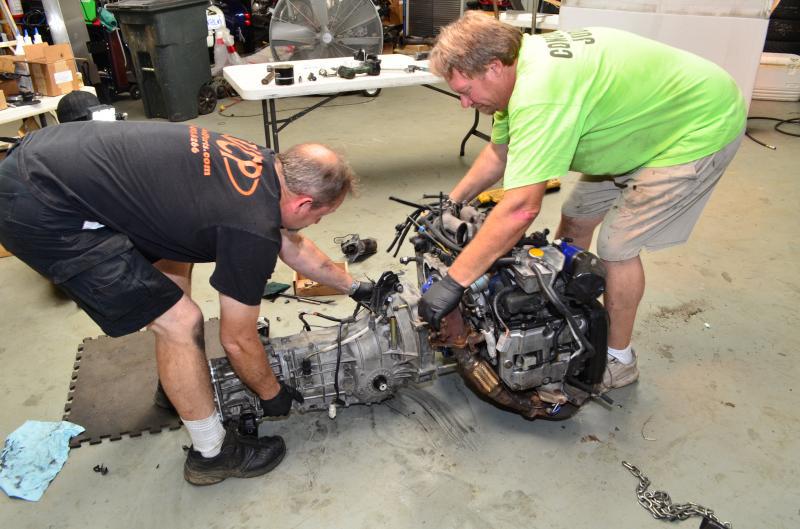
The width and height of the screenshot is (800, 529). What are the coordinates of `concrete floor` in the screenshot? It's located at (477, 491).